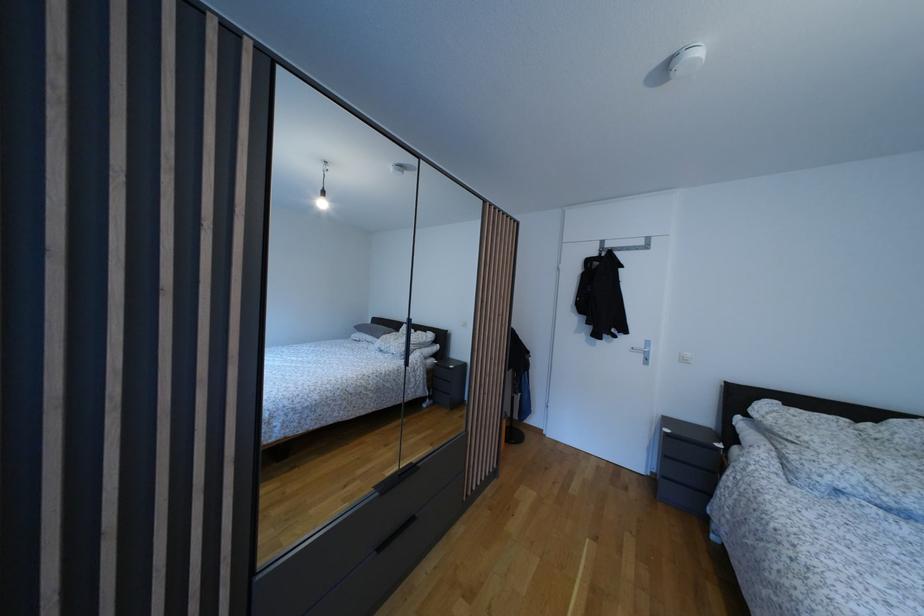
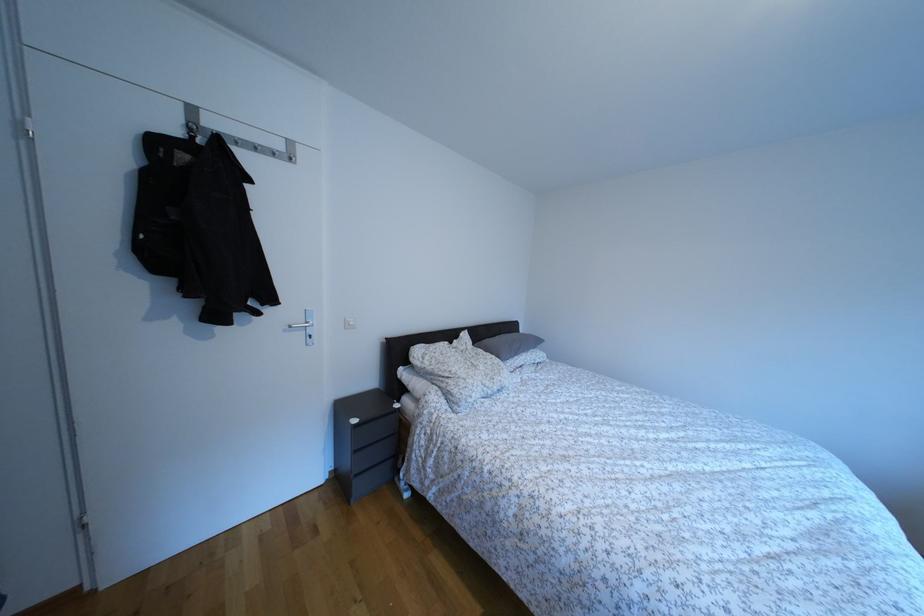
Where in the second image is the point corresponding to point (649, 249) from the first image?

(286, 152)